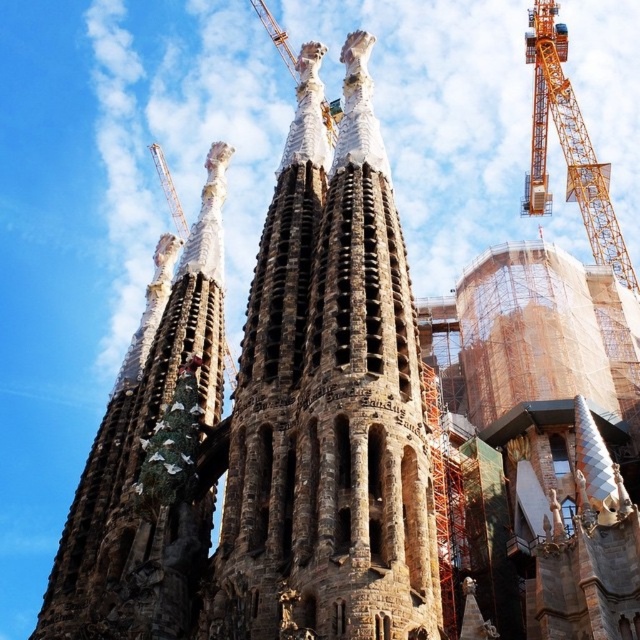
Question: Which of the following is the closest to the observer?

Choices:
 (A) (212, 211)
 (B) (148, 145)

Answer: (A)

Question: Does brown stone tower at center come behind orange metallic crane at upper left?

Choices:
 (A) no
 (B) yes

Answer: (A)

Question: Considering the relative positions of brown stone tower at center and orange metallic crane at upper left in the image provided, where is brown stone tower at center located with respect to orange metallic crane at upper left?

Choices:
 (A) left
 (B) right

Answer: (B)

Question: Does yellow metallic crane at upper right appear under orange metallic crane at upper left?

Choices:
 (A) yes
 (B) no

Answer: (B)

Question: Which point appears farthest from the camera in this image?

Choices:
 (A) (177, 198)
 (B) (333, 637)
 (C) (609, 240)
 (D) (61, 602)

Answer: (A)

Question: Considering the real-world distances, which object is closest to the brown stone tower at left?

Choices:
 (A) brown stone tower at center
 (B) yellow metallic crane at upper right
 (C) orange metallic crane at upper left

Answer: (A)